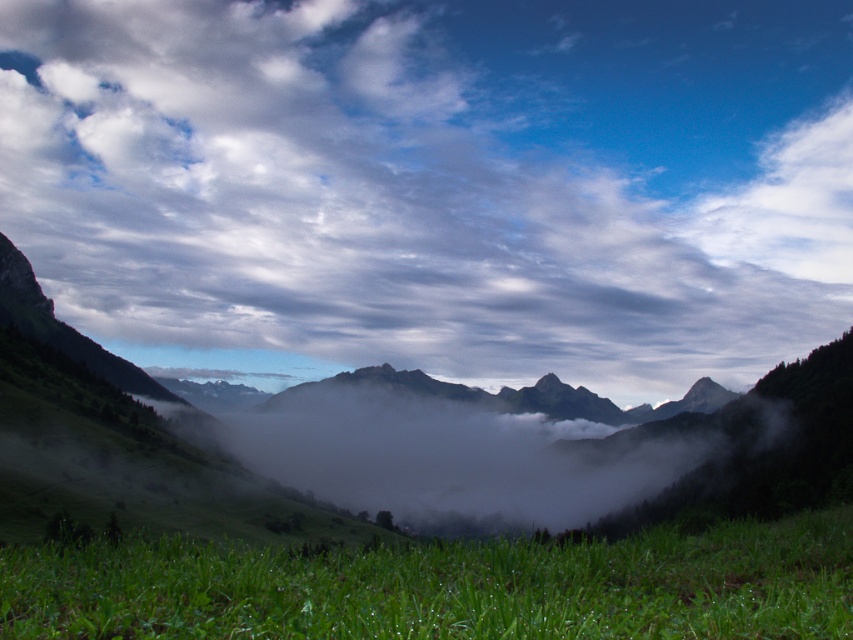
Is cloudy sky at upper center smaller than green grassy at lower center?

Incorrect, cloudy sky at upper center is not smaller in size than green grassy at lower center.

Which of these two, cloudy sky at upper center or green grassy at lower center, stands shorter?

Standing shorter between the two is green grassy at lower center.

Find the location of a particular element. Image resolution: width=853 pixels, height=640 pixels. cloudy sky at upper center is located at coordinates (436, 182).